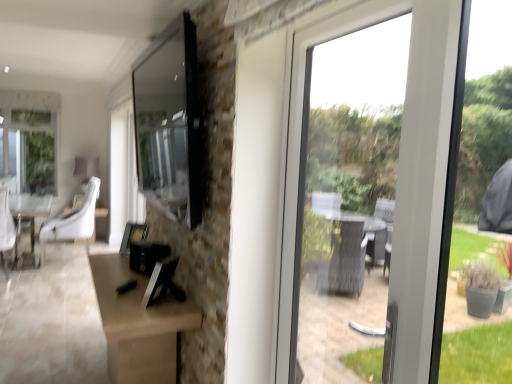
Find the location of `free spot below white leather swivel chair at left (from a real-world perspective)`. free spot below white leather swivel chair at left (from a real-world perspective) is located at coordinates (5, 273).